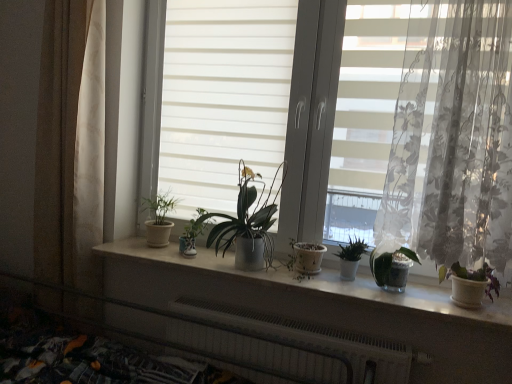
Question: From the image's perspective, is white metallic radiator at lower center above or below beige fabric curtain at left, the second curtain in the front-to-back sequence?

Choices:
 (A) above
 (B) below

Answer: (B)

Question: Is white metallic radiator at lower center in front of or behind beige fabric curtain at left, arranged as the first curtain when viewed from the left, in the image?

Choices:
 (A) behind
 (B) front

Answer: (B)

Question: Which object is the closest to the matte white pot at left, acting as the sixth houseplant starting from the right?

Choices:
 (A) white metallic radiator at lower center
 (B) translucent floral fabric at right, the 2th curtain in the back-to-front sequence
 (C) green matte plant at center, placed as the 3th houseplant when sorted from right to left
 (D) white ceramic window sill at center
 (E) matte white pot at center, the fourth houseplant positioned from the right

Answer: (D)

Question: Considering the real-world distances, which object is farthest from the matte white pot at left, acting as the sixth houseplant starting from the right?

Choices:
 (A) translucent glass vase at right, positioned as the second houseplant in right-to-left order
 (B) white ceramic window sill at center
 (C) matte white pot at center, the fourth houseplant positioned from the right
 (D) green matte plant at center, which ranks as the 2th houseplant in left-to-right order
 (E) purple matte plant at right, which is the first houseplant in right-to-left order

Answer: (E)